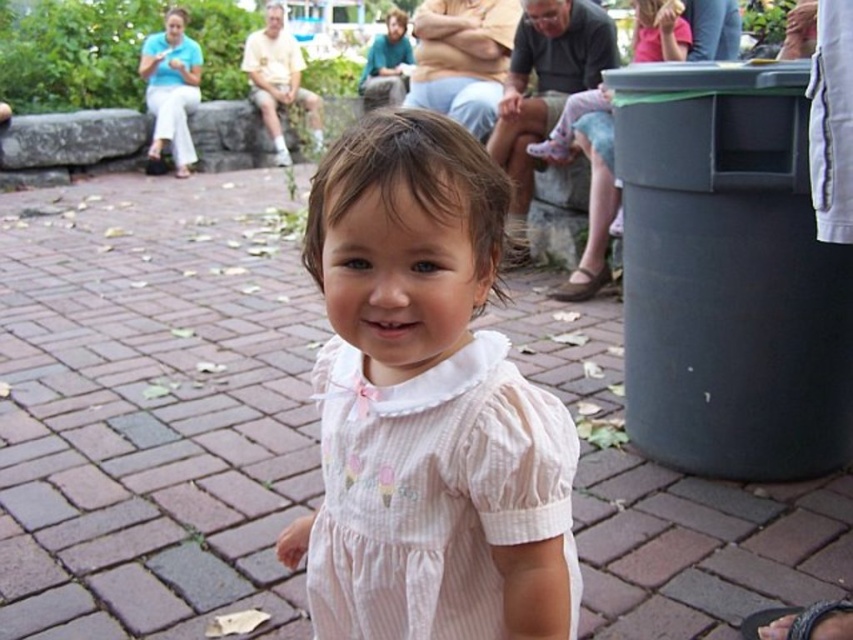
Question: Which point is farther from the camera taking this photo?

Choices:
 (A) (527, 440)
 (B) (584, 296)

Answer: (B)

Question: Which object is positioned closest to the pink striped dress at center?

Choices:
 (A) brown leather sandal at right
 (B) pink fabric dress at lower right

Answer: (A)

Question: Is pink fabric dress at lower right wider than brown leather sandal at right?

Choices:
 (A) yes
 (B) no

Answer: (A)

Question: Can you confirm if pink fabric dress at lower right is wider than brown leather sandal at right?

Choices:
 (A) yes
 (B) no

Answer: (A)

Question: Which point is farther to the camera?

Choices:
 (A) (573, 284)
 (B) (587, 292)

Answer: (A)

Question: Is pink striped dress at center positioned at the back of pink fabric dress at lower right?

Choices:
 (A) no
 (B) yes

Answer: (A)